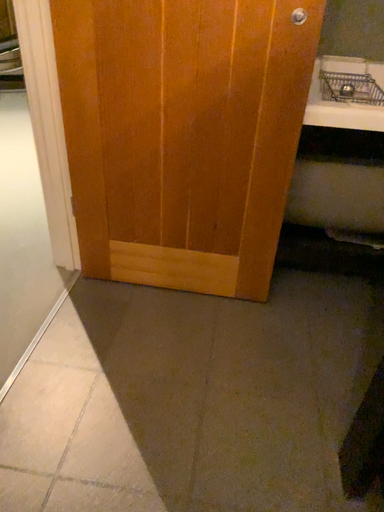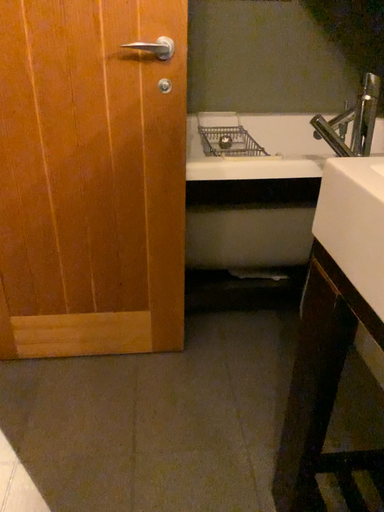
Question: How did the camera likely rotate when shooting the video?

Choices:
 (A) rotated right
 (B) rotated left

Answer: (A)